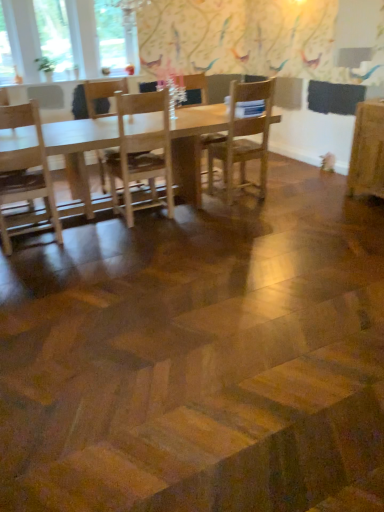
Question: Is wooden chair at center, the first chair viewed from the right, wider than white glass window at upper left, marked as the 1th window in a left-to-right arrangement?

Choices:
 (A) yes
 (B) no

Answer: (A)

Question: Is wooden chair at center, the first chair viewed from the right, closer to the viewer compared to white glass window at upper left, which is counted as the third window, starting from the right?

Choices:
 (A) yes
 (B) no

Answer: (A)

Question: Can you confirm if wooden chair at center, the first chair viewed from the right, is positioned to the left of white glass window at upper left, which is counted as the third window, starting from the right?

Choices:
 (A) yes
 (B) no

Answer: (B)

Question: Considering the relative positions of wooden chair at center, which appears as the third chair when viewed from the left, and white glass window at upper left, marked as the 1th window in a left-to-right arrangement, in the image provided, is wooden chair at center, which appears as the third chair when viewed from the left, to the right of white glass window at upper left, marked as the 1th window in a left-to-right arrangement, from the viewer's perspective?

Choices:
 (A) no
 (B) yes

Answer: (B)

Question: Considering the relative sizes of wooden chair at center, which appears as the third chair when viewed from the left, and white glass window at upper left, which is counted as the third window, starting from the right, in the image provided, is wooden chair at center, which appears as the third chair when viewed from the left, thinner than white glass window at upper left, which is counted as the third window, starting from the right,?

Choices:
 (A) no
 (B) yes

Answer: (A)

Question: Can we say wooden chair at center, the first chair viewed from the right, lies outside white glass window at upper left, marked as the 1th window in a left-to-right arrangement?

Choices:
 (A) no
 (B) yes

Answer: (B)

Question: Is wooden chair at center, the 1th chair viewed from the left, inside white glass window at upper left, marked as the 1th window in a left-to-right arrangement?

Choices:
 (A) yes
 (B) no

Answer: (B)

Question: Does white glass window at upper left, marked as the 1th window in a left-to-right arrangement, have a greater height compared to wooden chair at center, which is the 3th chair in right-to-left order?

Choices:
 (A) yes
 (B) no

Answer: (B)

Question: Does white glass window at upper left, marked as the 1th window in a left-to-right arrangement, have a lesser width compared to wooden chair at center, the 1th chair viewed from the left?

Choices:
 (A) no
 (B) yes

Answer: (B)

Question: Is white glass window at upper left, which is counted as the third window, starting from the right, shorter than wooden chair at center, which is the 3th chair in right-to-left order?

Choices:
 (A) yes
 (B) no

Answer: (A)

Question: From the image's perspective, is white glass window at upper left, marked as the 1th window in a left-to-right arrangement, beneath wooden chair at center, the 1th chair viewed from the left?

Choices:
 (A) yes
 (B) no

Answer: (B)

Question: Considering the relative positions of white glass window at upper left, which is counted as the third window, starting from the right, and wooden chair at center, which is the 3th chair in right-to-left order, in the image provided, is white glass window at upper left, which is counted as the third window, starting from the right, behind wooden chair at center, which is the 3th chair in right-to-left order,?

Choices:
 (A) yes
 (B) no

Answer: (A)

Question: Is clear glass window at upper left, which appears as the 3th window when viewed from the left, surrounded by clear glass window at upper left, the second window positioned from the left?

Choices:
 (A) no
 (B) yes

Answer: (A)